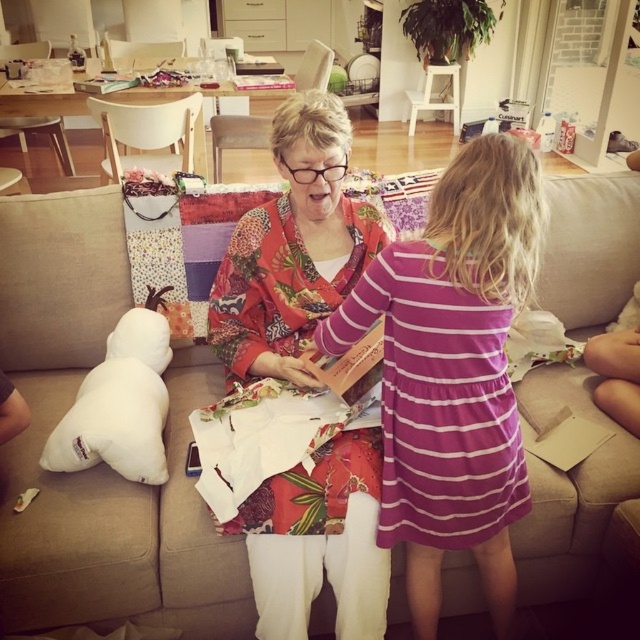
Question: Which point is closer to the camera taking this photo?

Choices:
 (A) (134, 339)
 (B) (380, 616)

Answer: (B)

Question: Is beige fabric couch at center above white soft pillow at lower left?

Choices:
 (A) no
 (B) yes

Answer: (A)

Question: Does beige fabric couch at center appear on the left side of floral fabric shawl at center?

Choices:
 (A) yes
 (B) no

Answer: (A)

Question: Does purple striped dress at center appear on the left side of floral fabric shawl at center?

Choices:
 (A) yes
 (B) no

Answer: (B)

Question: Estimate the real-world distances between objects in this image. Which object is closer to the purple striped dress at center?

Choices:
 (A) white soft pillow at lower left
 (B) beige fabric couch at center

Answer: (B)

Question: Which of the following is the closest to the observer?

Choices:
 (A) beige fabric couch at center
 (B) floral fabric shawl at center
 (C) purple striped dress at center
 (D) white soft pillow at lower left

Answer: (C)